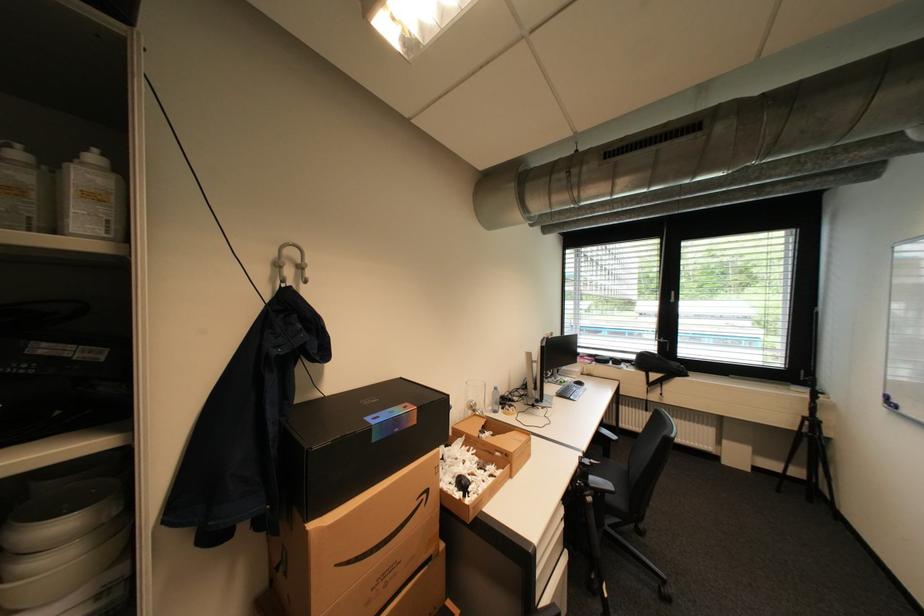
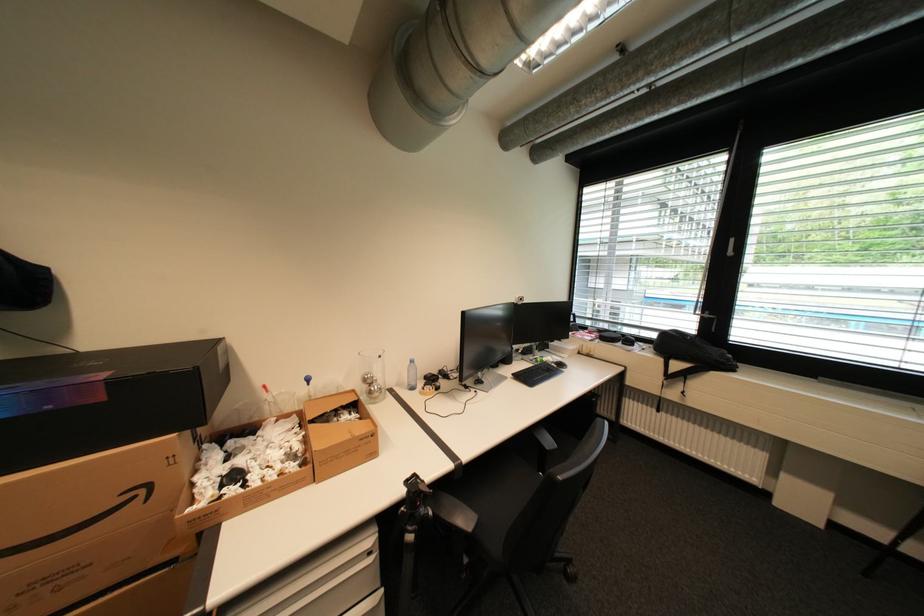
Where in the second image is the point corresponding to [687,355] from the first image?

(739, 339)